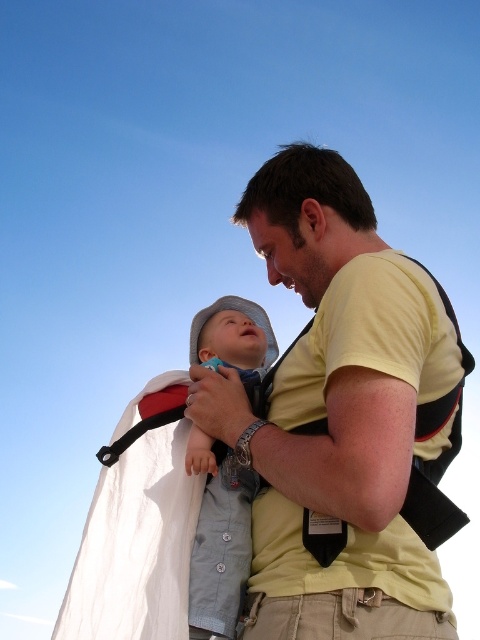
Question: Considering the real-world distances, which object is farthest from the light blue denim shirt at center?

Choices:
 (A) khaki cotton pants at lower center
 (B) yellow cotton shirt at center

Answer: (B)

Question: Does yellow cotton shirt at center come in front of light blue denim shirt at center?

Choices:
 (A) yes
 (B) no

Answer: (A)

Question: Can you confirm if yellow cotton shirt at center is positioned to the right of khaki cotton pants at lower center?

Choices:
 (A) no
 (B) yes

Answer: (B)

Question: Which is nearer to the khaki cotton pants at lower center?

Choices:
 (A) yellow cotton shirt at center
 (B) light blue denim shirt at center

Answer: (B)

Question: Is yellow cotton shirt at center smaller than khaki cotton pants at lower center?

Choices:
 (A) no
 (B) yes

Answer: (B)

Question: Based on their relative distances, which object is nearer to the yellow cotton shirt at center?

Choices:
 (A) light blue denim shirt at center
 (B) khaki cotton pants at lower center

Answer: (A)